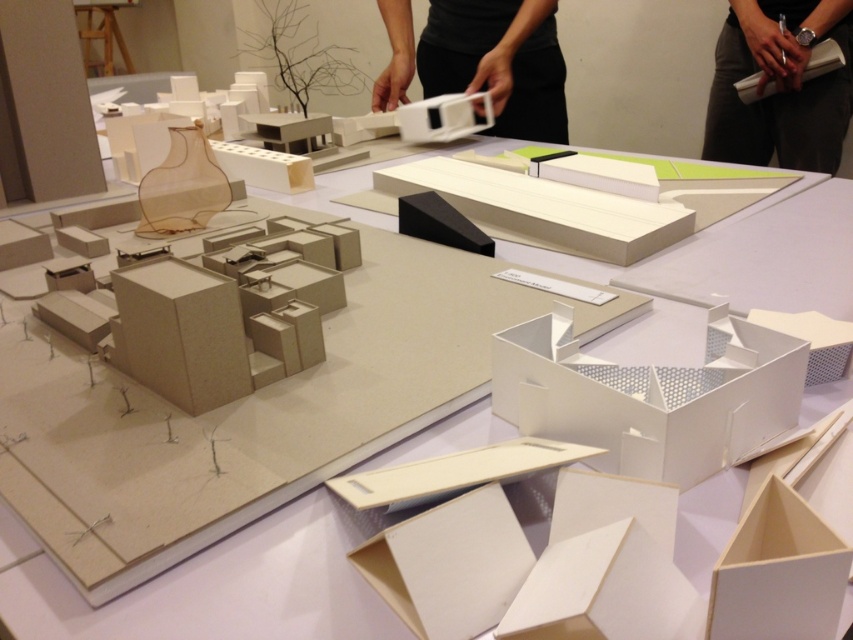
Is point (782, 148) farther from viewer compared to point (515, 113)?

Yes, point (782, 148) is behind point (515, 113).

Is black fabric at upper right thinner than matte white plastic model at upper center?

Yes, black fabric at upper right is thinner than matte white plastic model at upper center.

The width and height of the screenshot is (853, 640). What are the coordinates of `black fabric at upper right` in the screenshot? It's located at (780, 84).